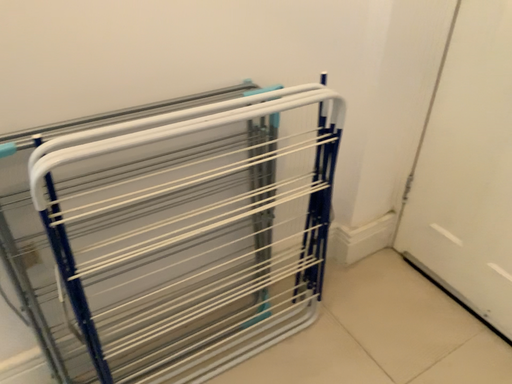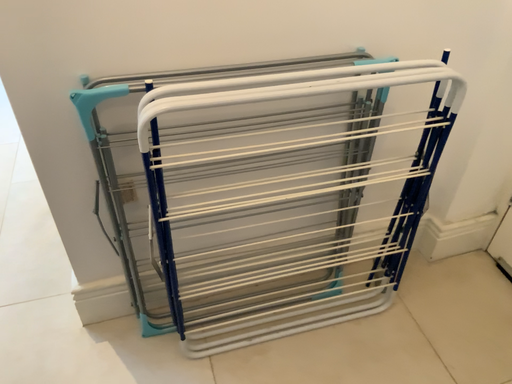
Question: How did the camera likely rotate when shooting the video?

Choices:
 (A) rotated left
 (B) rotated right

Answer: (A)